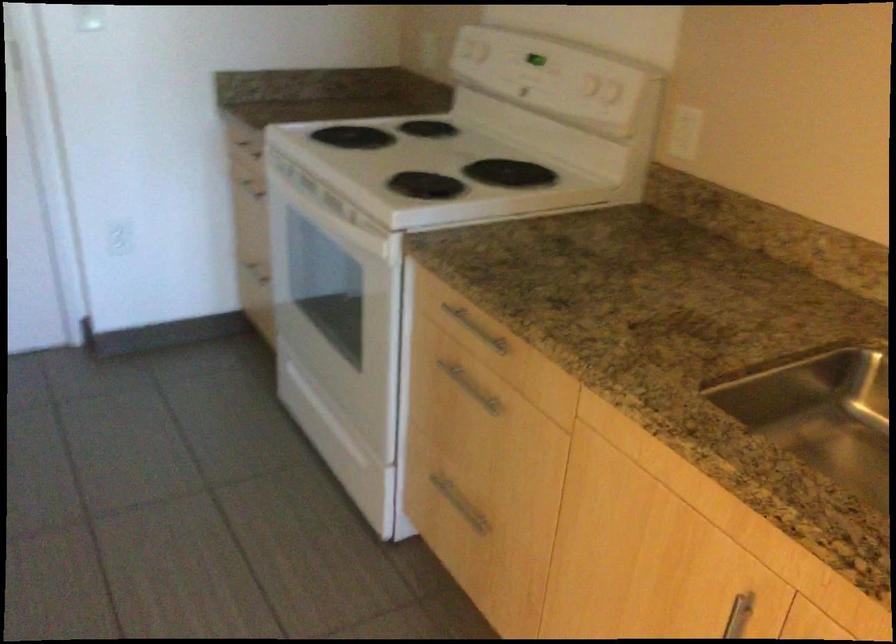
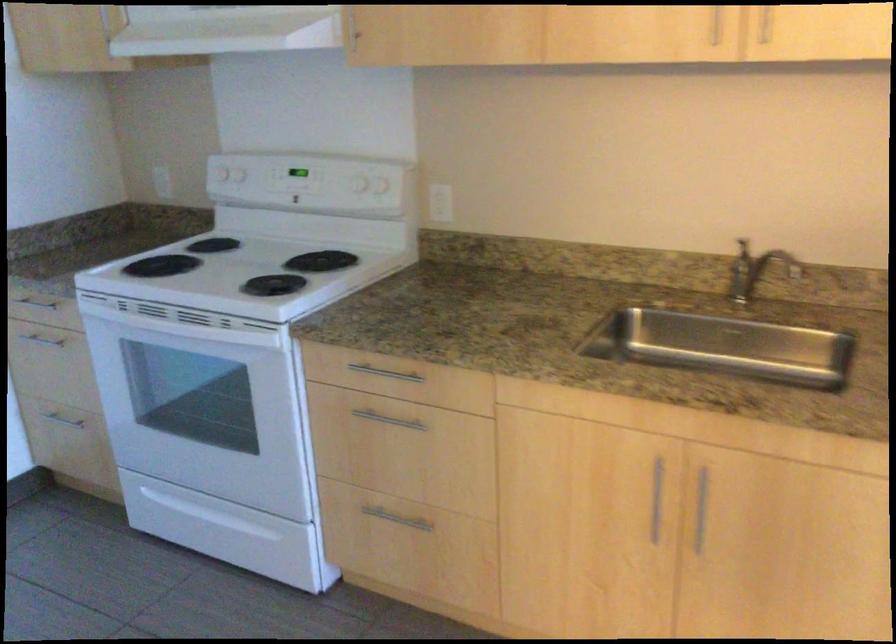
Question: The camera is either moving clockwise (left) or counter-clockwise (right) around the object. The first image is from the beginning of the video and the second image is from the end. Is the camera moving left or right when shooting the video?

Choices:
 (A) Left
 (B) Right

Answer: (A)